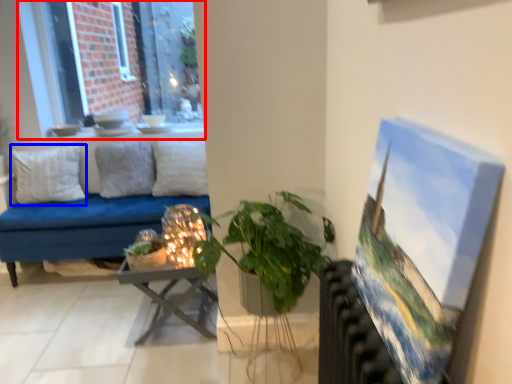
Question: Which object appears farthest to the camera in this image, window (highlighted by a red box) or pillow (highlighted by a blue box)?

Choices:
 (A) window
 (B) pillow

Answer: (A)